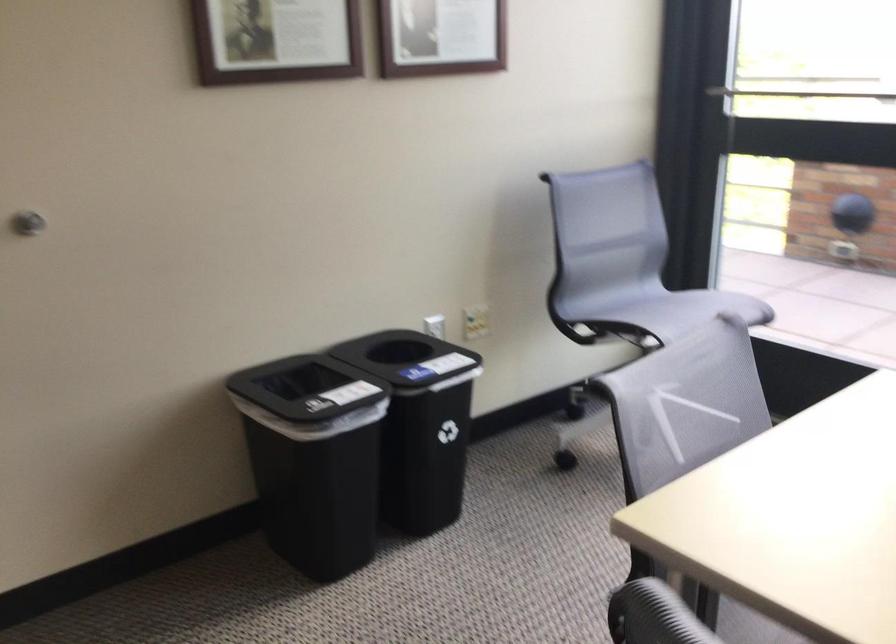
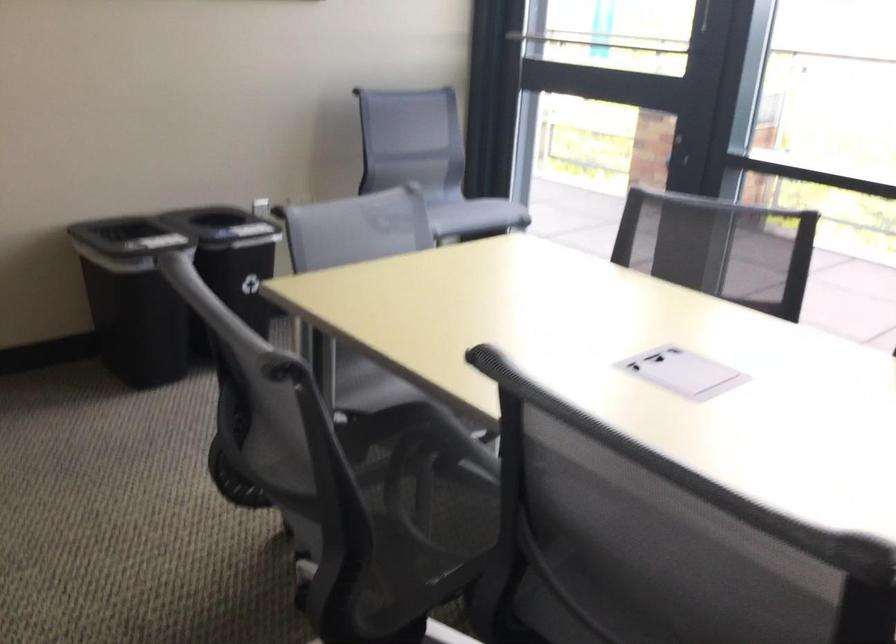
In the second image, find the point that corresponds to (x=703, y=312) in the first image.

(470, 213)